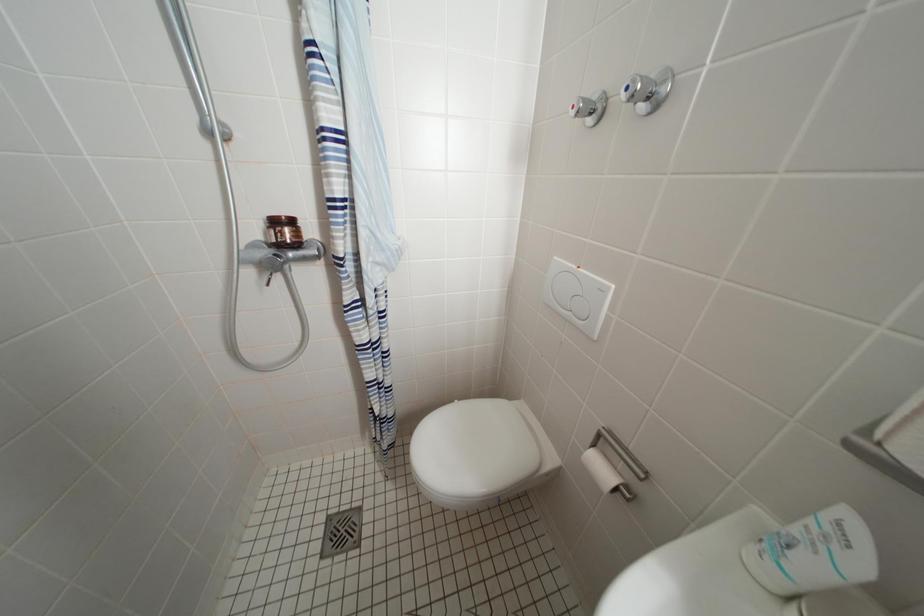
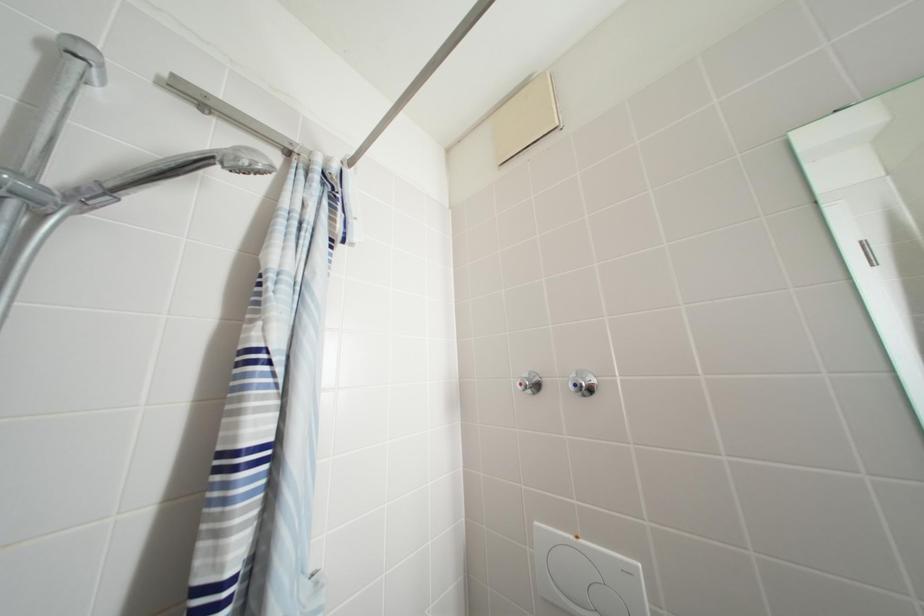
Based on the continuous images, in which direction is the camera rotating?

The camera's rotation is toward right-up.